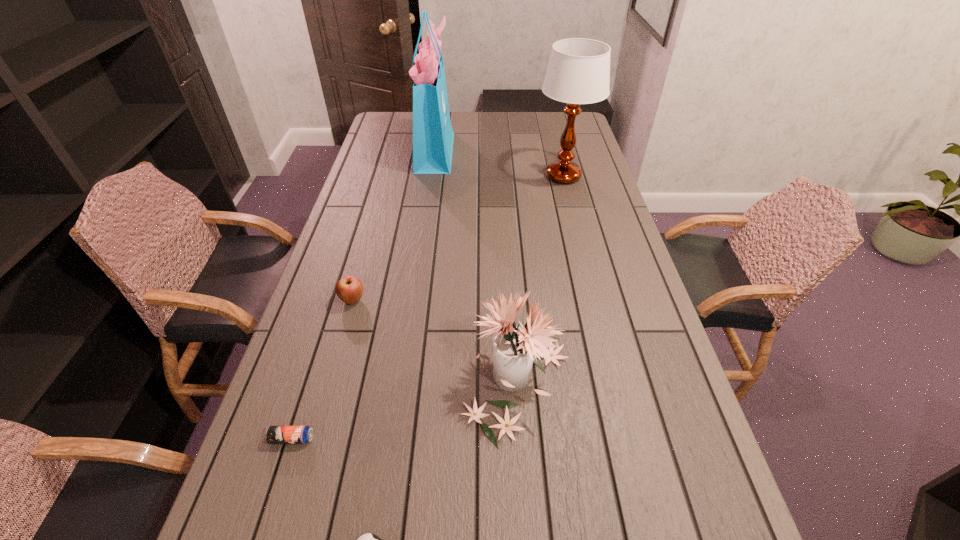
Identify the location of free spot located on the right of the beer can. (347, 438).

At what (x,y) coordinates should I click in order to perform the action: click on object situated at the far edge. Please return your answer as a coordinate pair (x, y). The width and height of the screenshot is (960, 540). Looking at the image, I should click on (433, 136).

Locate an element on the screen. The image size is (960, 540). apple present at the left edge is located at coordinates (349, 289).

Locate an element on the screen. beer can present at the left edge is located at coordinates (274, 434).

Where is `object present at the right edge`? The height and width of the screenshot is (540, 960). object present at the right edge is located at coordinates (578, 72).

Image resolution: width=960 pixels, height=540 pixels. In order to click on vacant space at the far edge of the desktop in this screenshot , I will do `click(504, 125)`.

Find the location of `free space at the left edge of the desktop`. free space at the left edge of the desktop is located at coordinates (375, 140).

At what (x,y) coordinates should I click in order to perform the action: click on vacant space at the right edge of the desktop. Please return your answer as a coordinate pair (x, y). The image size is (960, 540). Looking at the image, I should click on (673, 417).

Locate an element on the screen. vacant space at the far left corner of the desktop is located at coordinates (388, 133).

The width and height of the screenshot is (960, 540). Find the location of `empty space that is in between the beer can and the fourth shortest object`. empty space that is in between the beer can and the fourth shortest object is located at coordinates (404, 413).